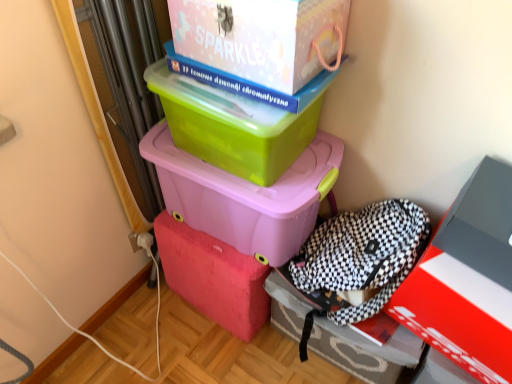
Describe the element at coordinates (232, 126) in the screenshot. Image resolution: width=512 pixels, height=384 pixels. I see `green plastic box at upper center, which is counted as the 4th box, starting from the bottom` at that location.

The width and height of the screenshot is (512, 384). Identify the location of green plastic box at upper center, which is counted as the 4th box, starting from the bottom. pyautogui.click(x=232, y=126).

Describe the element at coordinates (262, 37) in the screenshot. This screenshot has height=384, width=512. I see `matte white cardboard box at upper center, the first box viewed from the top` at that location.

This screenshot has height=384, width=512. Describe the element at coordinates (467, 279) in the screenshot. I see `matte red box at lower right, positioned as the 2th box in bottom-to-top order` at that location.

You are a GUI agent. You are given a task and a screenshot of the screen. Output one action in this format:
    pyautogui.click(x=<x>, y=<y>)
    Task: Click on the green plastic box at upper center, which is counted as the 4th box, starting from the bottom
    The height and width of the screenshot is (384, 512).
    Given the screenshot: What is the action you would take?
    coord(232,126)

Can you confirm if checkered fabric backpack at lower right, which appears as the 5th box when viewed from the top, is wider than matte red box at lower right, placed as the fourth box when sorted from top to bottom?

Correct, the width of checkered fabric backpack at lower right, which appears as the 5th box when viewed from the top, exceeds that of matte red box at lower right, placed as the fourth box when sorted from top to bottom.

Looking at this image, is matte red box at lower right, positioned as the 2th box in bottom-to-top order, at the back of checkered fabric backpack at lower right, which appears as the 5th box when viewed from the top?

No, checkered fabric backpack at lower right, which appears as the 5th box when viewed from the top, is not facing away from matte red box at lower right, positioned as the 2th box in bottom-to-top order.

Who is bigger, checkered fabric backpack at lower right, arranged as the first box when ordered from the bottom, or matte red box at lower right, positioned as the 2th box in bottom-to-top order?

checkered fabric backpack at lower right, arranged as the first box when ordered from the bottom.

From a real-world perspective, which object stands above the other?

matte red box at lower right, placed as the fourth box when sorted from top to bottom, from a real-world perspective.

Does point (177, 19) appear closer or farther from the camera than point (442, 266)?

Point (177, 19) is farther from the camera than point (442, 266).

Is matte red box at lower right, placed as the fourth box when sorted from top to bottom, a part of matte white cardboard box at upper center, marked as the fifth box in a bottom-to-top arrangement?

No, matte red box at lower right, placed as the fourth box when sorted from top to bottom, is not surrounded by matte white cardboard box at upper center, marked as the fifth box in a bottom-to-top arrangement.

Considering the relative sizes of matte white cardboard box at upper center, the first box viewed from the top, and matte red box at lower right, placed as the fourth box when sorted from top to bottom, in the image provided, is matte white cardboard box at upper center, the first box viewed from the top, shorter than matte red box at lower right, placed as the fourth box when sorted from top to bottom,?

Indeed, matte white cardboard box at upper center, the first box viewed from the top, has a lesser height compared to matte red box at lower right, placed as the fourth box when sorted from top to bottom.

From a real-world perspective, which is physically below, matte white cardboard box at upper center, the first box viewed from the top, or matte red box at lower right, placed as the fourth box when sorted from top to bottom?

matte red box at lower right, placed as the fourth box when sorted from top to bottom, is physically lower.

Considering the positions of objects green plastic box at upper center, which is the second box from top to bottom, and matte white cardboard box at upper center, marked as the fifth box in a bottom-to-top arrangement, in the image provided, who is more to the left, green plastic box at upper center, which is the second box from top to bottom, or matte white cardboard box at upper center, marked as the fifth box in a bottom-to-top arrangement,?

From the viewer's perspective, green plastic box at upper center, which is the second box from top to bottom, appears more on the left side.

Based on the photo, can you confirm if green plastic box at upper center, which is counted as the 4th box, starting from the bottom, is bigger than matte white cardboard box at upper center, the first box viewed from the top?

Actually, green plastic box at upper center, which is counted as the 4th box, starting from the bottom, might be smaller than matte white cardboard box at upper center, the first box viewed from the top.

Considering the relative sizes of green plastic box at upper center, which is counted as the 4th box, starting from the bottom, and matte white cardboard box at upper center, marked as the fifth box in a bottom-to-top arrangement, in the image provided, is green plastic box at upper center, which is counted as the 4th box, starting from the bottom, thinner than matte white cardboard box at upper center, marked as the fifth box in a bottom-to-top arrangement,?

Correct, the width of green plastic box at upper center, which is counted as the 4th box, starting from the bottom, is less than that of matte white cardboard box at upper center, marked as the fifth box in a bottom-to-top arrangement.

From the picture: Is green plastic box at upper center, which is the second box from top to bottom, positioned with its back to matte white cardboard box at upper center, marked as the fifth box in a bottom-to-top arrangement?

No.

Is matte white cardboard box at upper center, the first box viewed from the top, positioned behind green plastic box at upper center, which is counted as the 4th box, starting from the bottom?

No, it is in front of green plastic box at upper center, which is counted as the 4th box, starting from the bottom.

Looking at this image, is matte white cardboard box at upper center, the first box viewed from the top, facing towards green plastic box at upper center, which is counted as the 4th box, starting from the bottom?

No, matte white cardboard box at upper center, the first box viewed from the top, does not turn towards green plastic box at upper center, which is counted as the 4th box, starting from the bottom.

From a real-world perspective, is matte white cardboard box at upper center, the first box viewed from the top, physically below green plastic box at upper center, which is the second box from top to bottom?

No, from a real-world perspective, matte white cardboard box at upper center, the first box viewed from the top, is not below green plastic box at upper center, which is the second box from top to bottom.

Which of these two, matte white cardboard box at upper center, the first box viewed from the top, or green plastic box at upper center, which is counted as the 4th box, starting from the bottom, is wider?

matte white cardboard box at upper center, the first box viewed from the top, is wider.

Which is in front, matte white cardboard box at upper center, marked as the fifth box in a bottom-to-top arrangement, or matte plastic storage box at center, which is the 3th box from bottom to top?

matte white cardboard box at upper center, marked as the fifth box in a bottom-to-top arrangement, is closer to the camera.

Is matte white cardboard box at upper center, marked as the fifth box in a bottom-to-top arrangement, looking in the opposite direction of matte plastic storage box at center, marked as the third box in a top-to-bottom arrangement?

No, matte white cardboard box at upper center, marked as the fifth box in a bottom-to-top arrangement, is not facing away from matte plastic storage box at center, marked as the third box in a top-to-bottom arrangement.

Is matte white cardboard box at upper center, the first box viewed from the top, wider or thinner than matte plastic storage box at center, marked as the third box in a top-to-bottom arrangement?

Clearly, matte white cardboard box at upper center, the first box viewed from the top, has less width compared to matte plastic storage box at center, marked as the third box in a top-to-bottom arrangement.

From a real-world perspective, is matte white cardboard box at upper center, the first box viewed from the top, physically located above or below matte plastic storage box at center, marked as the third box in a top-to-bottom arrangement?

matte white cardboard box at upper center, the first box viewed from the top, is situated higher than matte plastic storage box at center, marked as the third box in a top-to-bottom arrangement, in the real world.

From the image's perspective, which is above, matte plastic storage box at center, marked as the third box in a top-to-bottom arrangement, or matte red box at lower right, positioned as the 2th box in bottom-to-top order?

matte plastic storage box at center, marked as the third box in a top-to-bottom arrangement.

From a real-world perspective, is matte plastic storage box at center, marked as the third box in a top-to-bottom arrangement, below matte red box at lower right, placed as the fourth box when sorted from top to bottom?

No, from a real-world perspective, matte plastic storage box at center, marked as the third box in a top-to-bottom arrangement, is not under matte red box at lower right, placed as the fourth box when sorted from top to bottom.

Is matte plastic storage box at center, which is the 3th box from bottom to top, to the left or to the right of matte red box at lower right, placed as the fourth box when sorted from top to bottom, in the image?

matte plastic storage box at center, which is the 3th box from bottom to top, is positioned on matte red box at lower right, placed as the fourth box when sorted from top to bottom,'s left side.

Measure the distance from matte plastic storage box at center, marked as the third box in a top-to-bottom arrangement, to matte red box at lower right, placed as the fourth box when sorted from top to bottom.

A distance of 17.61 inches exists between matte plastic storage box at center, marked as the third box in a top-to-bottom arrangement, and matte red box at lower right, placed as the fourth box when sorted from top to bottom.

From the picture: Is checkered fabric backpack at lower right, arranged as the first box when ordered from the bottom, wider or thinner than matte white cardboard box at upper center, marked as the fifth box in a bottom-to-top arrangement?

Considering their sizes, checkered fabric backpack at lower right, arranged as the first box when ordered from the bottom, looks broader than matte white cardboard box at upper center, marked as the fifth box in a bottom-to-top arrangement.

Considering the relative positions of checkered fabric backpack at lower right, which appears as the 5th box when viewed from the top, and matte white cardboard box at upper center, marked as the fifth box in a bottom-to-top arrangement, in the image provided, is checkered fabric backpack at lower right, which appears as the 5th box when viewed from the top, to the left or to the right of matte white cardboard box at upper center, marked as the fifth box in a bottom-to-top arrangement,?

Based on their positions, checkered fabric backpack at lower right, which appears as the 5th box when viewed from the top, is located to the right of matte white cardboard box at upper center, marked as the fifth box in a bottom-to-top arrangement.

Looking at this image, from a real-world perspective, between checkered fabric backpack at lower right, arranged as the first box when ordered from the bottom, and matte white cardboard box at upper center, marked as the fifth box in a bottom-to-top arrangement, who is vertically lower?

checkered fabric backpack at lower right, arranged as the first box when ordered from the bottom, from a real-world perspective.

Is checkered fabric backpack at lower right, arranged as the first box when ordered from the bottom, positioned behind matte white cardboard box at upper center, the first box viewed from the top?

Yes, it is.

Locate an element on the screen. The width and height of the screenshot is (512, 384). box that is the 3rd one when counting forward from the checkered fabric backpack at lower right, which appears as the 5th box when viewed from the top is located at coordinates (467, 279).

The width and height of the screenshot is (512, 384). What are the coordinates of `box that is the 2nd one when counting leftward from the matte red box at lower right, positioned as the 2th box in bottom-to-top order` in the screenshot? It's located at (262, 37).

Considering their positions, is checkered fabric backpack at lower right, arranged as the first box when ordered from the bottom, positioned closer to matte plastic storage box at center, which is the 3th box from bottom to top, than matte white cardboard box at upper center, marked as the fifth box in a bottom-to-top arrangement?

Based on the image, checkered fabric backpack at lower right, arranged as the first box when ordered from the bottom, appears to be nearer to matte plastic storage box at center, which is the 3th box from bottom to top.

Considering their positions, is matte plastic storage box at center, which is the 3th box from bottom to top, positioned further to matte red box at lower right, placed as the fourth box when sorted from top to bottom, than green plastic box at upper center, which is counted as the 4th box, starting from the bottom?

green plastic box at upper center, which is counted as the 4th box, starting from the bottom.

Based on their spatial positions, is matte white cardboard box at upper center, the first box viewed from the top, or matte plastic storage box at center, marked as the third box in a top-to-bottom arrangement, closer to checkered fabric backpack at lower right, arranged as the first box when ordered from the bottom?

matte plastic storage box at center, marked as the third box in a top-to-bottom arrangement.

Which object lies nearer to the anchor point checkered fabric backpack at lower right, which appears as the 5th box when viewed from the top, matte plastic storage box at center, which is the 3th box from bottom to top, or matte red box at lower right, positioned as the 2th box in bottom-to-top order?

matte red box at lower right, positioned as the 2th box in bottom-to-top order.

When comparing their distances from matte plastic storage box at center, which is the 3th box from bottom to top, does matte white cardboard box at upper center, the first box viewed from the top, or matte red box at lower right, positioned as the 2th box in bottom-to-top order, seem closer?

The object closer to matte plastic storage box at center, which is the 3th box from bottom to top, is matte white cardboard box at upper center, the first box viewed from the top.

From the image, which object appears to be nearer to matte plastic storage box at center, marked as the third box in a top-to-bottom arrangement, matte red box at lower right, placed as the fourth box when sorted from top to bottom, or green plastic box at upper center, which is counted as the 4th box, starting from the bottom?

Based on the image, green plastic box at upper center, which is counted as the 4th box, starting from the bottom, appears to be nearer to matte plastic storage box at center, marked as the third box in a top-to-bottom arrangement.

Which object lies further to the anchor point green plastic box at upper center, which is counted as the 4th box, starting from the bottom, matte white cardboard box at upper center, marked as the fifth box in a bottom-to-top arrangement, or matte red box at lower right, positioned as the 2th box in bottom-to-top order?

Among the two, matte red box at lower right, positioned as the 2th box in bottom-to-top order, is located further to green plastic box at upper center, which is counted as the 4th box, starting from the bottom.

Considering their positions, is green plastic box at upper center, which is counted as the 4th box, starting from the bottom, positioned closer to checkered fabric backpack at lower right, which appears as the 5th box when viewed from the top, than matte plastic storage box at center, marked as the third box in a top-to-bottom arrangement?

The object closer to checkered fabric backpack at lower right, which appears as the 5th box when viewed from the top, is matte plastic storage box at center, marked as the third box in a top-to-bottom arrangement.

This screenshot has height=384, width=512. I want to click on box between matte white cardboard box at upper center, marked as the fifth box in a bottom-to-top arrangement, and matte plastic storage box at center, which is the 3th box from bottom to top, from top to bottom, so click(x=232, y=126).